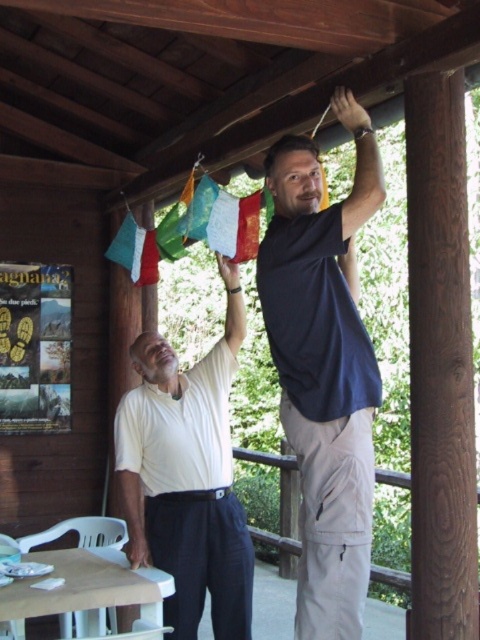
Question: Where is dark blue t-shirt at upper center located in relation to white cotton shirt at upper center in the image?

Choices:
 (A) right
 (B) left

Answer: (A)

Question: Is dark blue t-shirt at upper center in front of white cotton shirt at upper center?

Choices:
 (A) no
 (B) yes

Answer: (B)

Question: Can you confirm if dark blue t-shirt at upper center is positioned below white cotton shirt at upper center?

Choices:
 (A) no
 (B) yes

Answer: (A)

Question: Which of the following is the closest to the observer?

Choices:
 (A) white cotton shirt at upper center
 (B) dark blue t-shirt at upper center

Answer: (B)

Question: Which point appears farthest from the camera in this image?

Choices:
 (A) (136, 440)
 (B) (276, 145)

Answer: (A)